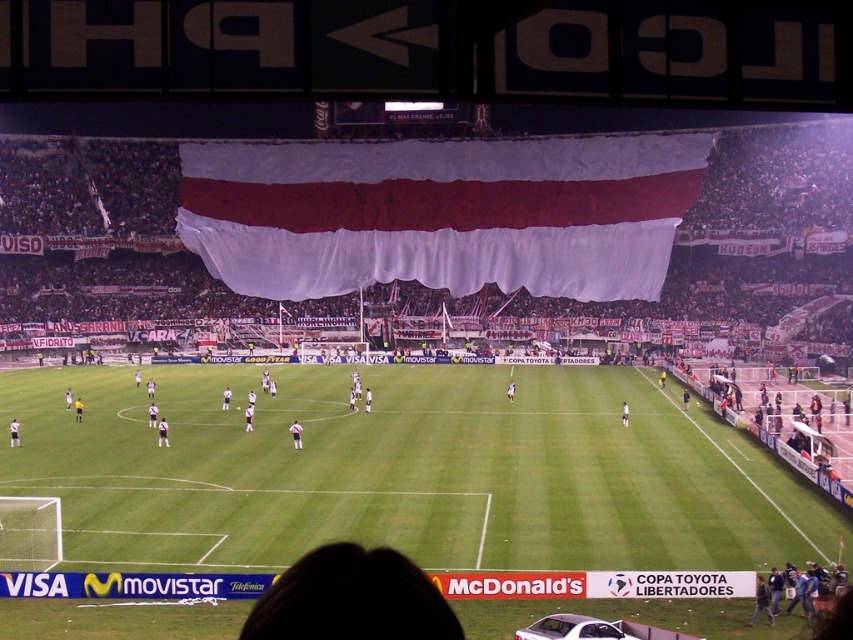
In the scene shown: You are a drone operator trying to capture aerial footage of the soccer match. Your drone has a maximum flight range of 40 meters. If you are positioned above the green grass football field at center, can you fly your drone to the white fabric banner at center without exceeding its range?

The green grass football field at center and white fabric banner at center are 41.95 meters apart from each other. Since the drone has a maximum range of 40 meters, it cannot reach the white fabric banner at center without exceeding its range.

You are a photographer trying to capture the entire soccer match scene. You notice the green grass football field at center and the white fabric banner at center. Which object is wider from your perspective?

The white fabric banner at center is wider than the green grass football field at center.

You are a photographer standing at the edge of the field. You want to capture a photo that includes both the green grass football field at center and the white fabric banner at center. Which object should you position closer to the foreground to ensure both are in focus?

The green grass football field at center has a lesser height compared to the white fabric banner at center. To ensure both are in focus, position the white fabric banner at center closer to the foreground since it is taller and will require less depth of field adjustment.